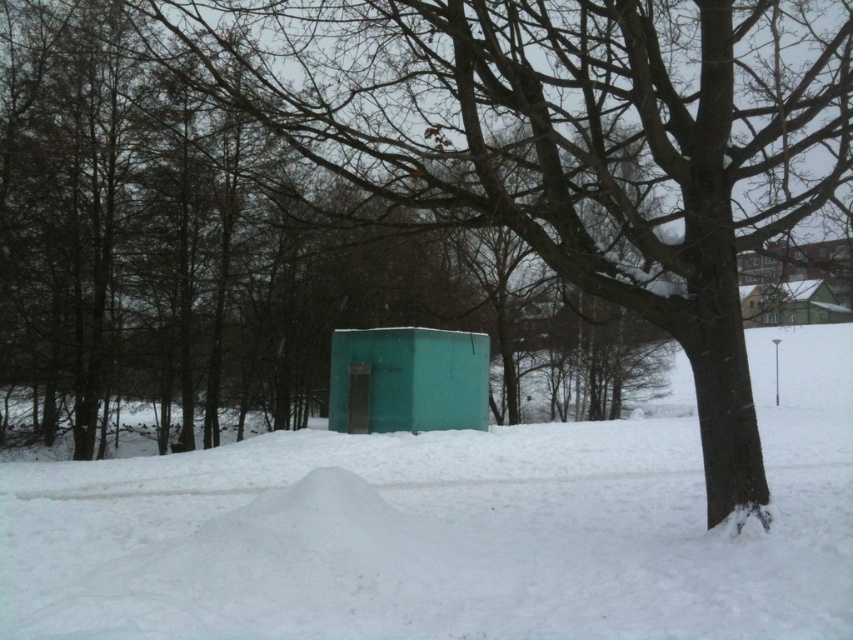
Looking at this image, does white fluffy snow at center come in front of green matte shed at upper right?

That is True.

Which is in front, point (698, 618) or point (752, 292)?

Point (698, 618) is more forward.

What do you see at coordinates (451, 529) in the screenshot? I see `white fluffy snow at center` at bounding box center [451, 529].

The height and width of the screenshot is (640, 853). Find the location of `white fluffy snow at center`. white fluffy snow at center is located at coordinates (451, 529).

Which is behind, point (335, 586) or point (419, 422)?

The point (419, 422) is behind.

Can you confirm if white fluffy snow at center is bigger than green matte shelter at center?

Yes, white fluffy snow at center is bigger than green matte shelter at center.

You are a GUI agent. You are given a task and a screenshot of the screen. Output one action in this format:
    pyautogui.click(x=<x>, y=<y>)
    Task: Click on the white fluffy snow at center
    The image size is (853, 640).
    Given the screenshot: What is the action you would take?
    451,529

Who is more distant from viewer, (380, 397) or (788, 324)?

The point (788, 324) is behind.

Can you confirm if green matte shelter at center is smaller than green matte shed at upper right?

Indeed, green matte shelter at center has a smaller size compared to green matte shed at upper right.

Does point (387, 406) come behind point (798, 304)?

Yes, it is behind point (798, 304).

Image resolution: width=853 pixels, height=640 pixels. I want to click on green matte shelter at center, so click(407, 380).